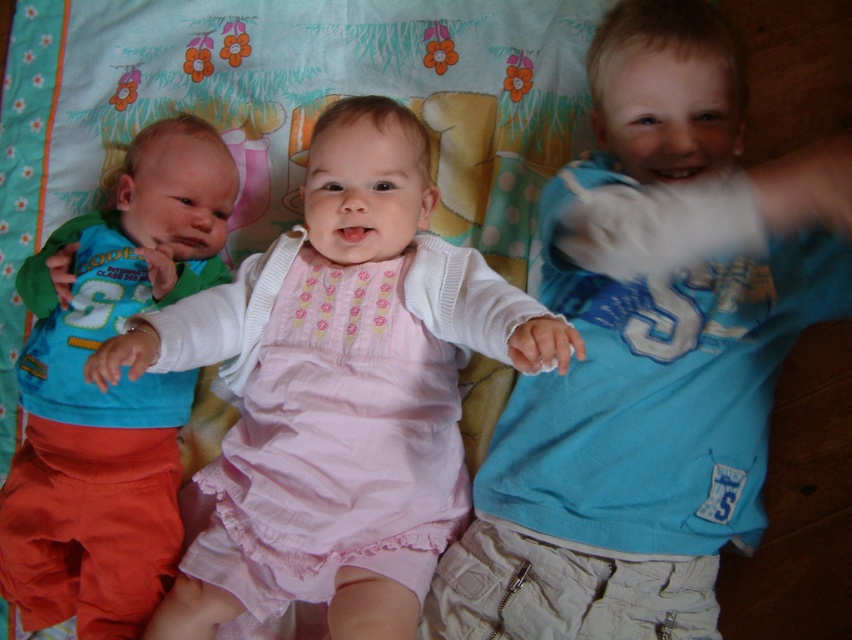
Question: Which of the following is the farthest from the observer?

Choices:
 (A) matte blue shirt at left
 (B) blue cotton shirt at center

Answer: (B)

Question: Is blue cotton shirt at center bigger than matte green t-shirt at left?

Choices:
 (A) yes
 (B) no

Answer: (A)

Question: Is blue cotton shirt at center wider than matte green t-shirt at left?

Choices:
 (A) no
 (B) yes

Answer: (B)

Question: Does blue cotton shirt at center have a greater width compared to matte blue shirt at left?

Choices:
 (A) yes
 (B) no

Answer: (A)

Question: Which object is farther from the camera taking this photo?

Choices:
 (A) matte blue shirt at left
 (B) blue cotton shirt at center
 (C) matte green t-shirt at left

Answer: (C)

Question: Which point is farther from the camera taking this photo?

Choices:
 (A) (738, 259)
 (B) (76, 470)
 (C) (289, 324)

Answer: (B)